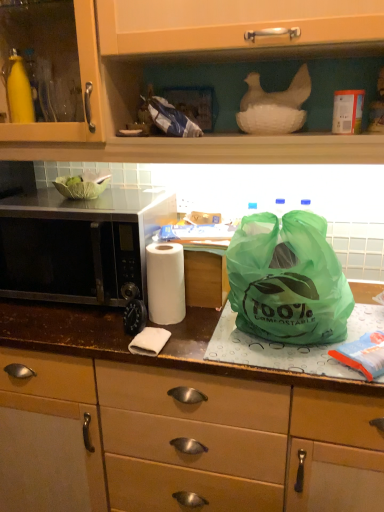
Question: From a real-world perspective, is green plastic bag at center, acting as the 2th cabinetry starting from the top, over matte wood cabinet at upper center, the first cabinetry from the top?

Choices:
 (A) yes
 (B) no

Answer: (B)

Question: From the image's perspective, is green plastic bag at center, the first cabinetry in the bottom-to-top sequence, over matte wood cabinet at upper center, the first cabinetry from the top?

Choices:
 (A) yes
 (B) no

Answer: (B)

Question: Can you confirm if green plastic bag at center, acting as the 2th cabinetry starting from the top, is smaller than matte wood cabinet at upper center, placed as the second cabinetry when sorted from bottom to top?

Choices:
 (A) no
 (B) yes

Answer: (A)

Question: From the image's perspective, is green plastic bag at center, the first cabinetry in the bottom-to-top sequence, beneath matte wood cabinet at upper center, the first cabinetry from the top?

Choices:
 (A) yes
 (B) no

Answer: (A)

Question: Is black matte microwave at left spatially inside green plastic bag at center, the first cabinetry in the bottom-to-top sequence, or outside of it?

Choices:
 (A) outside
 (B) inside

Answer: (A)

Question: From a real-world perspective, is black matte microwave at left physically located above or below green plastic bag at center, acting as the 2th cabinetry starting from the top?

Choices:
 (A) below
 (B) above

Answer: (B)

Question: Based on their positions, is black matte microwave at left located to the left or right of green plastic bag at center, acting as the 2th cabinetry starting from the top?

Choices:
 (A) left
 (B) right

Answer: (A)

Question: Based on their sizes in the image, would you say black matte microwave at left is bigger or smaller than green plastic bag at center, acting as the 2th cabinetry starting from the top?

Choices:
 (A) small
 (B) big

Answer: (A)

Question: From the image's perspective, is green compostable bag at center positioned above or below matte wood cabinet at upper center, the first cabinetry from the top?

Choices:
 (A) above
 (B) below

Answer: (B)

Question: From a real-world perspective, is green compostable bag at center above or below matte wood cabinet at upper center, placed as the second cabinetry when sorted from bottom to top?

Choices:
 (A) above
 (B) below

Answer: (B)

Question: Is green compostable bag at center wider or thinner than matte wood cabinet at upper center, the first cabinetry from the top?

Choices:
 (A) thin
 (B) wide

Answer: (A)

Question: Is point [x=259, y=295] closer or farther from the camera than point [x=340, y=136]?

Choices:
 (A) closer
 (B) farther

Answer: (A)

Question: Is green plastic bag at center, the first cabinetry in the bottom-to-top sequence, inside the boundaries of matte wood cabinet at upper center, placed as the second cabinetry when sorted from bottom to top, or outside?

Choices:
 (A) inside
 (B) outside

Answer: (B)

Question: Is green plastic bag at center, acting as the 2th cabinetry starting from the top, in front of or behind matte wood cabinet at upper center, placed as the second cabinetry when sorted from bottom to top, in the image?

Choices:
 (A) front
 (B) behind

Answer: (B)